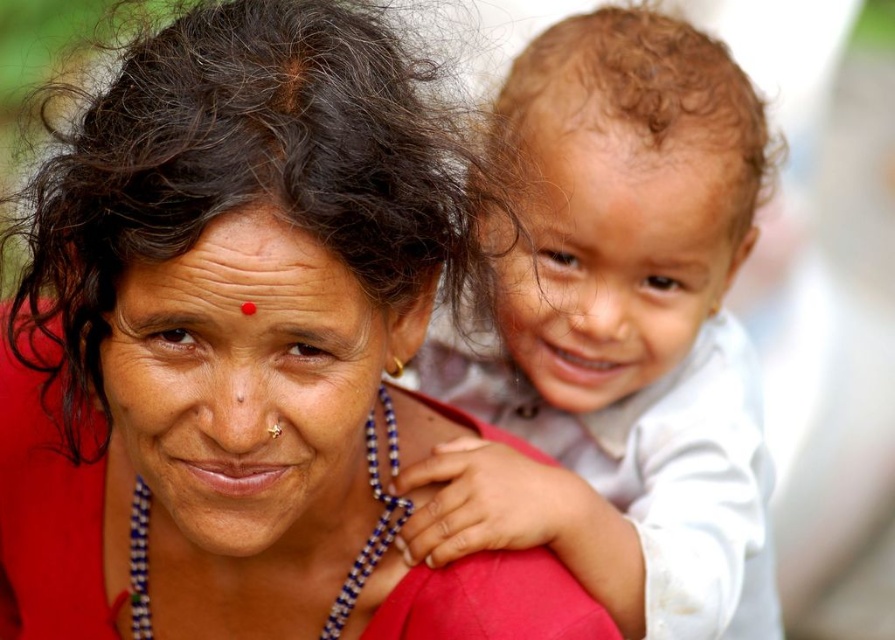
Can you confirm if smooth white shirt at right is thinner than dark brown curly hair at upper right?

No, smooth white shirt at right is not thinner than dark brown curly hair at upper right.

Is point (696, 538) farther from camera compared to point (345, 8)?

Yes, point (696, 538) is behind point (345, 8).

Which is behind, point (632, 529) or point (333, 157)?

The point (632, 529) is more distant.

What are the coordinates of `smooth white shirt at right` in the screenshot? It's located at (620, 333).

Does point (425, 349) come behind point (384, 492)?

Yes, point (425, 349) is farther from viewer.

Locate an element on the screen. smooth white shirt at right is located at coordinates (620, 333).

The width and height of the screenshot is (895, 640). I want to click on dark brown curly hair at upper right, so click(x=234, y=176).

Between dark brown curly hair at upper right and blue beaded necklace at center, which one is positioned higher?

dark brown curly hair at upper right

Does point (277, 6) lie behind point (148, 621)?

No, it is in front of (148, 621).

This screenshot has width=895, height=640. Find the location of `dark brown curly hair at upper right`. dark brown curly hair at upper right is located at coordinates (234, 176).